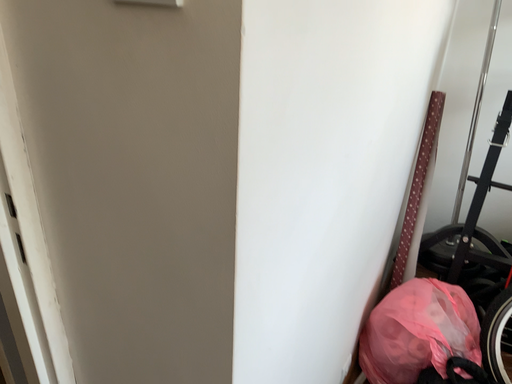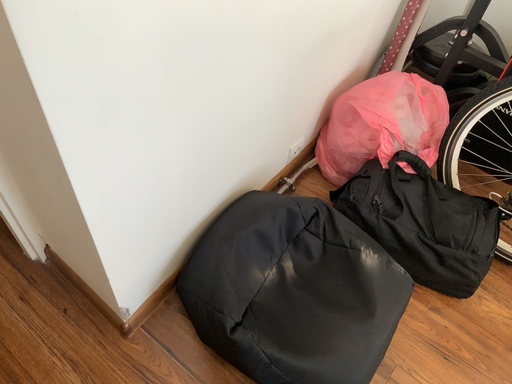
Question: Which way did the camera rotate in the video?

Choices:
 (A) rotated right
 (B) rotated left

Answer: (B)